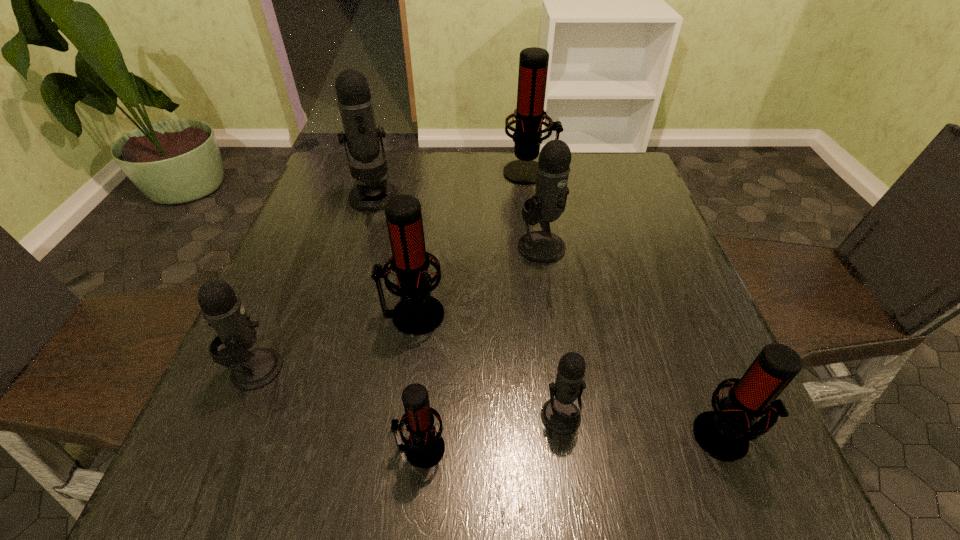
Where is `the third red microphone from left to right`? This screenshot has width=960, height=540. the third red microphone from left to right is located at coordinates (533, 63).

Find the location of a particular element. The width and height of the screenshot is (960, 540). the biggest red microphone is located at coordinates (533, 63).

Where is `the third black microphone from right to left`? The width and height of the screenshot is (960, 540). the third black microphone from right to left is located at coordinates (355, 103).

What are the coordinates of `the farthest black microphone` in the screenshot? It's located at (355, 103).

I want to click on the sixth nearest microphone, so click(x=553, y=168).

Image resolution: width=960 pixels, height=540 pixels. I want to click on the third farthest object, so click(553, 168).

Where is `the third nearest red microphone`? the third nearest red microphone is located at coordinates (418, 313).

At what (x,y) coordinates should I click in order to perform the action: click on the fifth nearest object. Please return your answer as a coordinate pair (x, y). Looking at the image, I should click on (418, 313).

The width and height of the screenshot is (960, 540). I want to click on the second smallest red microphone, so click(724, 433).

Locate an element on the screen. The height and width of the screenshot is (540, 960). the rightmost object is located at coordinates (724, 433).